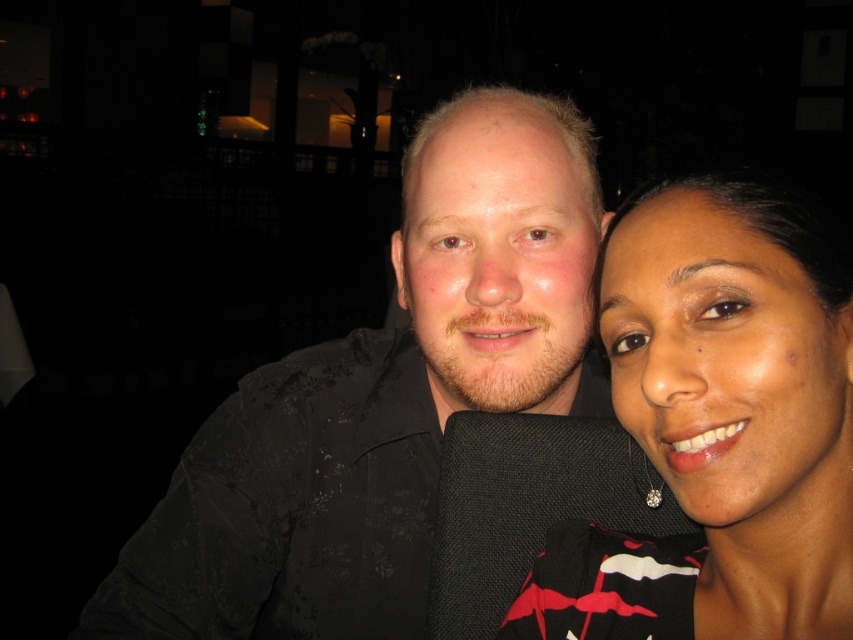
You are a photographer setting up for a portrait session. You want to ensure that both the black textured shirt at center and the matte black dress at right are clearly visible in the photo. Considering their positions, which one might be more challenging to capture due to lighting conditions, and why?

The matte black dress at right might be more challenging to capture because it is positioned behind the black textured shirt at center, which could cause it to blend into the background and become less distinct in the image.